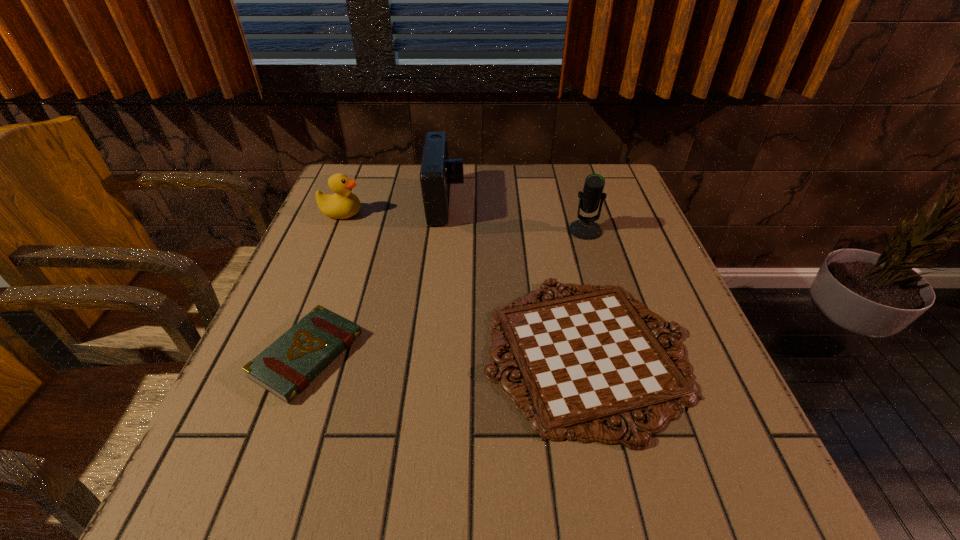
Where is `free location that satisfies the following two spatial constraints: 1. on the back side of the chessboard; 2. on the right side of the book`? free location that satisfies the following two spatial constraints: 1. on the back side of the chessboard; 2. on the right side of the book is located at coordinates (308, 352).

What are the coordinates of `free region that satisfies the following two spatial constraints: 1. on the front-facing side of the camera; 2. on the right side of the shortest object` in the screenshot? It's located at (429, 352).

The image size is (960, 540). Identify the location of vacant space that satisfies the following two spatial constraints: 1. on the front-facing side of the shortest object; 2. on the right side of the third object from left to right. (429, 352).

Where is `vacant space that satisfies the following two spatial constraints: 1. at the beak of the third shortest object; 2. on the back side of the shortest object`? This screenshot has width=960, height=540. vacant space that satisfies the following two spatial constraints: 1. at the beak of the third shortest object; 2. on the back side of the shortest object is located at coordinates tap(284, 352).

I want to click on free space that satisfies the following two spatial constraints: 1. on the front-facing side of the camera; 2. on the back side of the microphone, so pyautogui.click(x=443, y=230).

Identify the location of blank space that satisfies the following two spatial constraints: 1. at the beak of the duck; 2. on the back side of the microphone. Image resolution: width=960 pixels, height=540 pixels. (334, 230).

Identify the location of vacant region that satisfies the following two spatial constraints: 1. at the beak of the third tallest object; 2. on the left side of the microphone. This screenshot has height=540, width=960. (334, 230).

The image size is (960, 540). I want to click on free space that satisfies the following two spatial constraints: 1. on the back side of the chessboard; 2. on the front-facing side of the third object from right to left, so click(x=553, y=204).

Find the location of a particular element. The image size is (960, 540). vacant position in the image that satisfies the following two spatial constraints: 1. at the beak of the third shortest object; 2. on the left side of the shortest object is located at coordinates (284, 352).